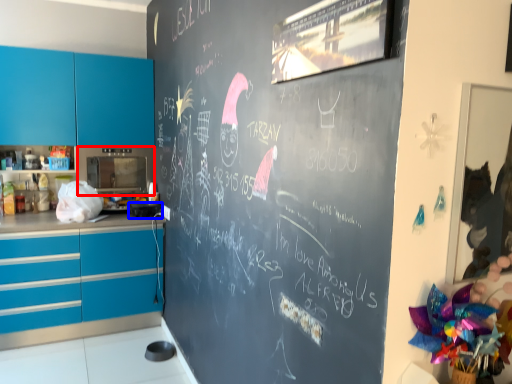
Question: Which object is closer to the camera taking this photo, appliance (highlighted by a red box) or appliance (highlighted by a blue box)?

Choices:
 (A) appliance
 (B) appliance

Answer: (B)